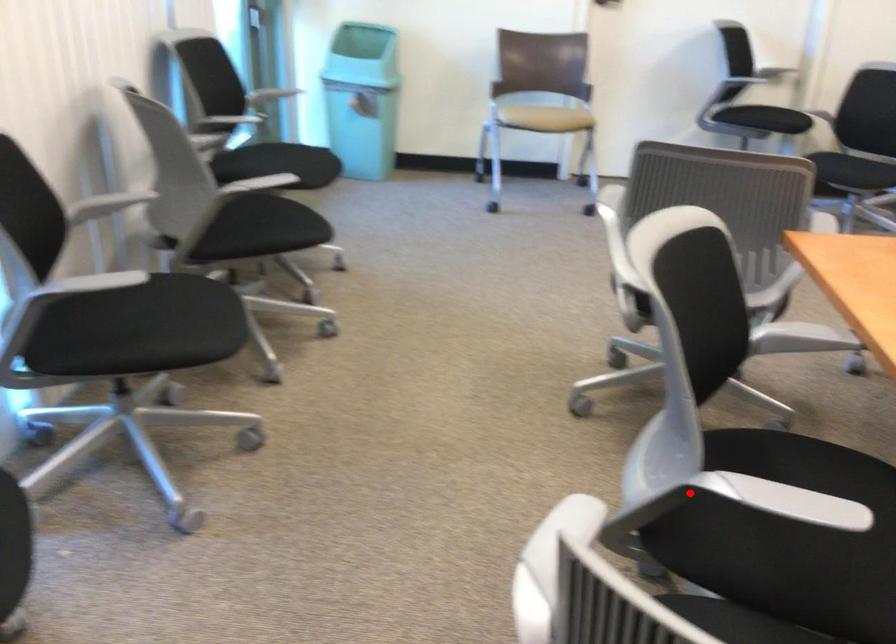
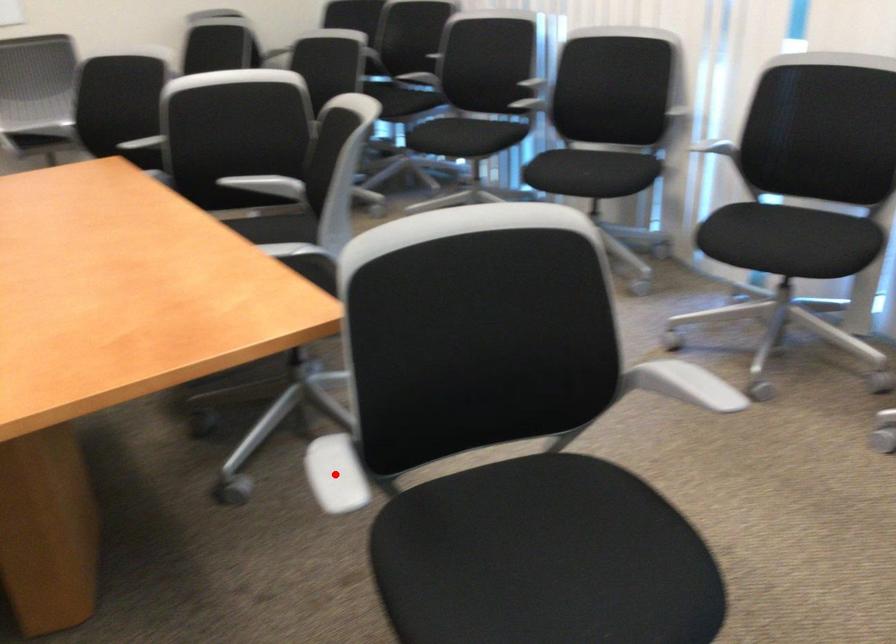
I am providing you with two images of the same scene from different viewpoints. A red point is marked on the first image and another point is marked on the second image. Is the red point in image1 aligned with the point shown in image2?

No